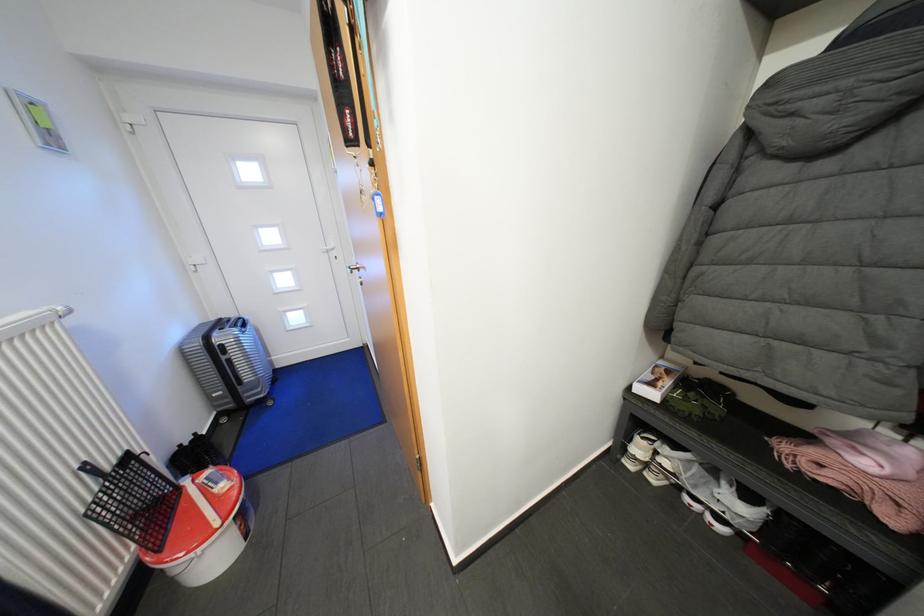
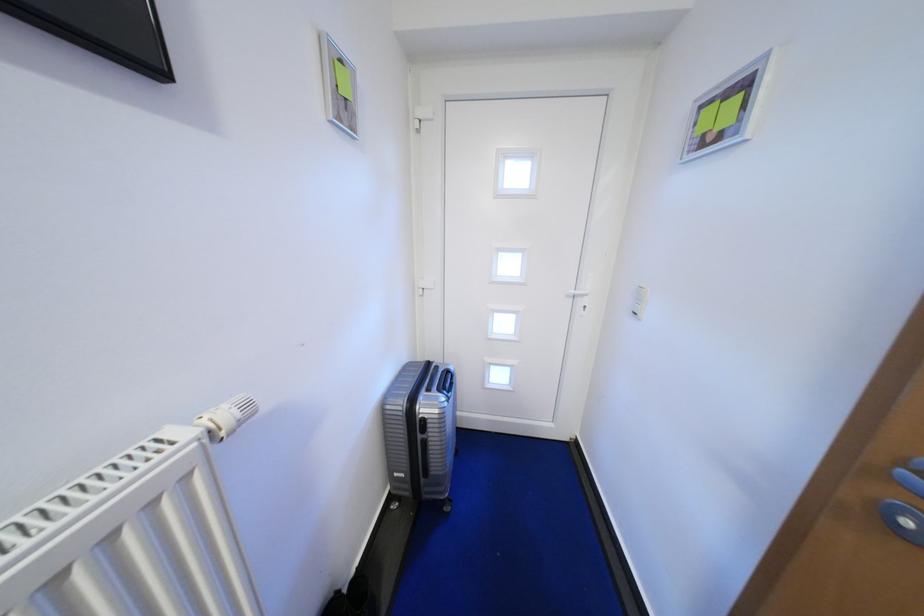
The point at (234,329) is marked in the first image. Where is the corresponding point in the second image?

(441, 392)